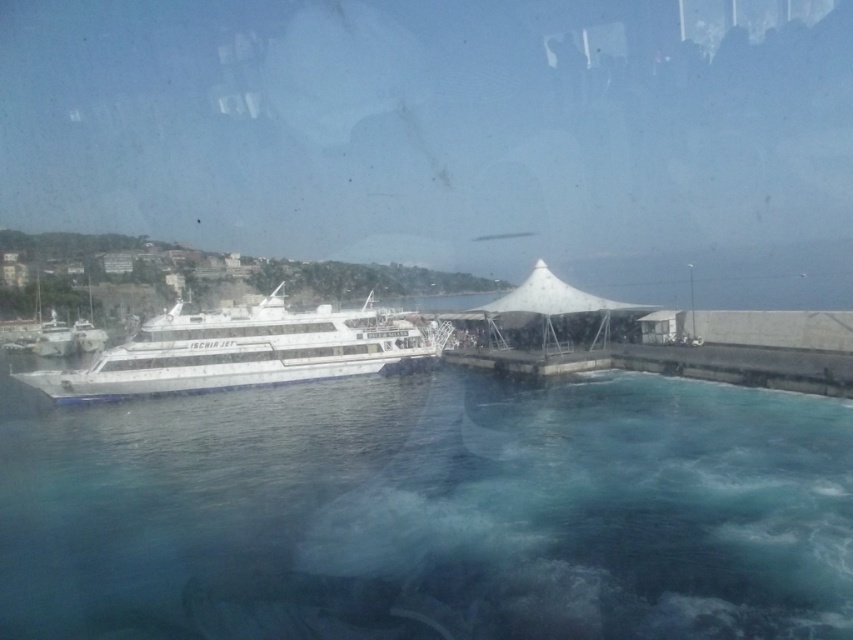
You are standing at the edge of the pier looking at the ferry and the conical tent structure. There are two points marked on the glass surface you are looking through. One is at coordinate point [737,616] and the other at [183,372]. Which of these points is nearer to your eyes?

Point [737,616] is closer to the camera than point [183,372], so the point at [737,616] is nearer to your eyes.

You are standing in front of the window and want to know where the clear blue water at lower center is located. Can you tell me its exact position using the coordinate system where the bottom left corner is the origin point?

The clear blue water at lower center is located at coordinate point (428, 513).